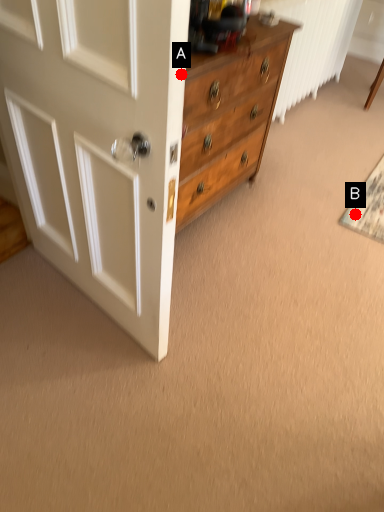
Question: Two points are circled on the image, labeled by A and B beside each circle. Which point is closer to the camera taking this photo?

Choices:
 (A) A is closer
 (B) B is closer

Answer: (A)